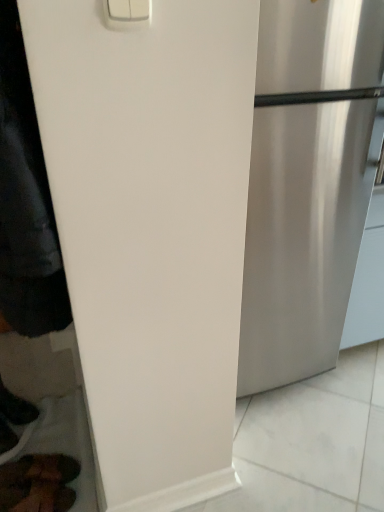
The image size is (384, 512). What are the coordinates of `brown leather shoes at lower left` in the screenshot? It's located at (38, 483).

What do you see at coordinates (25, 201) in the screenshot? The height and width of the screenshot is (512, 384). I see `black matte jacket at left` at bounding box center [25, 201].

The height and width of the screenshot is (512, 384). In order to click on black matte jacket at left in this screenshot , I will do `click(25, 201)`.

Describe the element at coordinates (303, 236) in the screenshot. This screenshot has width=384, height=512. I see `satin silver refrigerator at right` at that location.

The width and height of the screenshot is (384, 512). In order to click on satin silver refrigerator at right in this screenshot , I will do `click(303, 236)`.

In order to click on brown leather shoes at lower left in this screenshot , I will do `click(38, 483)`.

Is black matte jacket at left behind satin silver refrigerator at right?

No, it is in front of satin silver refrigerator at right.

Does black matte jacket at left have a greater height compared to satin silver refrigerator at right?

No.

Is black matte jacket at left far away from satin silver refrigerator at right?

They are positioned close to each other.

Between satin silver refrigerator at right and black matte jacket at left, which one has larger width?

Wider between the two is satin silver refrigerator at right.

The height and width of the screenshot is (512, 384). Identify the location of jacket above the satin silver refrigerator at right (from a real-world perspective). (25, 201).

Looking at the image, does satin silver refrigerator at right seem bigger or smaller compared to black matte jacket at left?

satin silver refrigerator at right is bigger than black matte jacket at left.

Considering the relative positions of satin silver refrigerator at right and black matte jacket at left in the image provided, is satin silver refrigerator at right in front of black matte jacket at left?

No, satin silver refrigerator at right is behind black matte jacket at left.

Can you confirm if black matte jacket at left is wider than black leather shoe at lower left?

In fact, black matte jacket at left might be narrower than black leather shoe at lower left.

Does black matte jacket at left appear on the left side of black leather shoe at lower left?

Incorrect, black matte jacket at left is not on the left side of black leather shoe at lower left.

From a real-world perspective, which is physically above, black matte jacket at left or black leather shoe at lower left?

In real-world perspective, black matte jacket at left is above.

Which is behind, point (57, 239) or point (7, 393)?

The point (7, 393) is farther.

Does black leather shoe at lower left appear on the right side of black matte jacket at left?

No.

The image size is (384, 512). Identify the location of shoe beneath the black matte jacket at left (from a real-world perspective). (16, 408).

Between black leather shoe at lower left and black matte jacket at left, which one has less height?

Standing shorter between the two is black leather shoe at lower left.

Consider the image. Is black leather shoe at lower left inside or outside of black matte jacket at left?

black leather shoe at lower left is located beyond the bounds of black matte jacket at left.

Is satin silver refrigerator at right at the right side of brown leather shoes at lower left?

Yes.

Is satin silver refrigerator at right wider or thinner than brown leather shoes at lower left?

satin silver refrigerator at right is wider than brown leather shoes at lower left.

Is point (264, 35) positioned in front of point (21, 481)?

Yes.

Which is in front, satin silver refrigerator at right or brown leather shoes at lower left?

brown leather shoes at lower left is in front.

From their relative heights in the image, would you say brown leather shoes at lower left is taller or shorter than black matte jacket at left?

Clearly, brown leather shoes at lower left is shorter compared to black matte jacket at left.

From a real-world perspective, who is located higher, brown leather shoes at lower left or black matte jacket at left?

black matte jacket at left, from a real-world perspective.

Is point (50, 486) behind point (43, 284)?

Yes, point (50, 486) is farther from viewer.

Does brown leather shoes at lower left come behind black matte jacket at left?

Yes.

Which object is closer to the camera taking this photo, black leather shoe at lower left or brown leather shoes at lower left?

brown leather shoes at lower left is closer to the camera.

Considering the sizes of objects black leather shoe at lower left and brown leather shoes at lower left in the image provided, who is wider, black leather shoe at lower left or brown leather shoes at lower left?

brown leather shoes at lower left is wider.

From a real-world perspective, which is physically above, black leather shoe at lower left or brown leather shoes at lower left?

From a 3D spatial view, black leather shoe at lower left is above.

Does point (17, 416) come behind point (3, 503)?

Yes, point (17, 416) is behind point (3, 503).

At what (x,y) coordinates should I click in order to perform the action: click on jacket positioned vertically above the satin silver refrigerator at right (from a real-world perspective). Please return your answer as a coordinate pair (x, y). Image resolution: width=384 pixels, height=512 pixels. Looking at the image, I should click on (25, 201).

This screenshot has width=384, height=512. I want to click on refrigerator on the right of black matte jacket at left, so click(x=303, y=236).

Looking at the image, which one is located closer to black matte jacket at left, black leather shoe at lower left or brown leather shoes at lower left?

brown leather shoes at lower left lies closer to black matte jacket at left than the other object.

When comparing their distances from brown leather shoes at lower left, does black matte jacket at left or satin silver refrigerator at right seem closer?

Based on the image, black matte jacket at left appears to be nearer to brown leather shoes at lower left.

Estimate the real-world distances between objects in this image. Which object is further from satin silver refrigerator at right, black matte jacket at left or black leather shoe at lower left?

black leather shoe at lower left is further to satin silver refrigerator at right.

From the image, which object appears to be nearer to brown leather shoes at lower left, black matte jacket at left or black leather shoe at lower left?

black leather shoe at lower left lies closer to brown leather shoes at lower left than the other object.

Looking at the image, which one is located further to black leather shoe at lower left, black matte jacket at left or brown leather shoes at lower left?

black matte jacket at left.

Based on the photo, which object lies nearer to the anchor point black leather shoe at lower left, satin silver refrigerator at right or brown leather shoes at lower left?

The object closer to black leather shoe at lower left is brown leather shoes at lower left.

Which object lies nearer to the anchor point satin silver refrigerator at right, brown leather shoes at lower left or black matte jacket at left?

Among the two, black matte jacket at left is located nearer to satin silver refrigerator at right.

When comparing their distances from black leather shoe at lower left, does brown leather shoes at lower left or black matte jacket at left seem further?

black matte jacket at left is positioned further to the anchor black leather shoe at lower left.

Where is `jacket between brown leather shoes at lower left and satin silver refrigerator at right in the horizontal direction`? jacket between brown leather shoes at lower left and satin silver refrigerator at right in the horizontal direction is located at coordinates tap(25, 201).

At what (x,y) coordinates should I click in order to perform the action: click on footwear between black matte jacket at left and black leather shoe at lower left in the front-back direction. Please return your answer as a coordinate pair (x, y). Looking at the image, I should click on (38, 483).

This screenshot has width=384, height=512. What are the coordinates of `footwear between black leather shoe at lower left and satin silver refrigerator at right in the horizontal direction` in the screenshot? It's located at (38, 483).

Locate an element on the screen. This screenshot has height=512, width=384. jacket located between black leather shoe at lower left and satin silver refrigerator at right in the left-right direction is located at coordinates (25, 201).